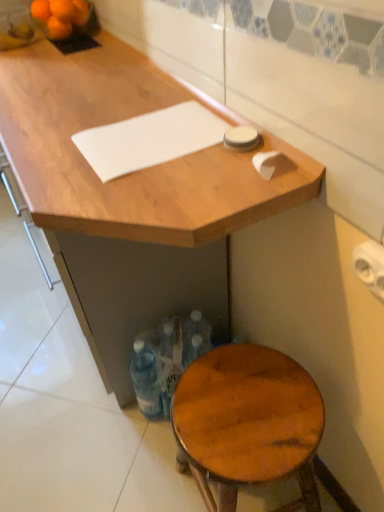
Question: Can you confirm if orange matte at upper left is shorter than white matte cutting board at upper center?

Choices:
 (A) yes
 (B) no

Answer: (B)

Question: Would you say white matte cutting board at upper center is part of orange matte at upper left's contents?

Choices:
 (A) no
 (B) yes

Answer: (A)

Question: Is orange matte at upper left not inside white matte cutting board at upper center?

Choices:
 (A) yes
 (B) no

Answer: (A)

Question: Is orange matte at upper left positioned behind white matte cutting board at upper center?

Choices:
 (A) no
 (B) yes

Answer: (B)

Question: Considering the relative sizes of orange matte at upper left and white matte cutting board at upper center in the image provided, is orange matte at upper left smaller than white matte cutting board at upper center?

Choices:
 (A) no
 (B) yes

Answer: (B)

Question: Is orange matte at upper left oriented towards white matte cutting board at upper center?

Choices:
 (A) yes
 (B) no

Answer: (B)

Question: Does orange matte tangerine at upper left, which is the first tangerine from front to back, have a lesser height compared to orange matte tangerine at upper left, acting as the first tangerine starting from the back?

Choices:
 (A) yes
 (B) no

Answer: (B)

Question: Is there a large distance between orange matte tangerine at upper left, which is the first tangerine from front to back, and orange matte tangerine at upper left, acting as the first tangerine starting from the back?

Choices:
 (A) yes
 (B) no

Answer: (B)

Question: Does orange matte tangerine at upper left, which is the first tangerine from front to back, turn towards orange matte tangerine at upper left, the fourth tangerine in the front-to-back sequence?

Choices:
 (A) no
 (B) yes

Answer: (A)

Question: Is orange matte tangerine at upper left, the 4th tangerine positioned from the back, behind orange matte tangerine at upper left, the fourth tangerine in the front-to-back sequence?

Choices:
 (A) yes
 (B) no

Answer: (B)

Question: Is orange matte tangerine at upper left, the 4th tangerine positioned from the back, taller than orange matte tangerine at upper left, the fourth tangerine in the front-to-back sequence?

Choices:
 (A) yes
 (B) no

Answer: (A)

Question: From the image's perspective, is orange matte tangerine at upper left, the 4th tangerine positioned from the back, located above orange matte tangerine at upper left, acting as the first tangerine starting from the back?

Choices:
 (A) yes
 (B) no

Answer: (B)

Question: Is translucent plastic bottles at lower center a part of white matte cutting board at upper center?

Choices:
 (A) no
 (B) yes

Answer: (A)